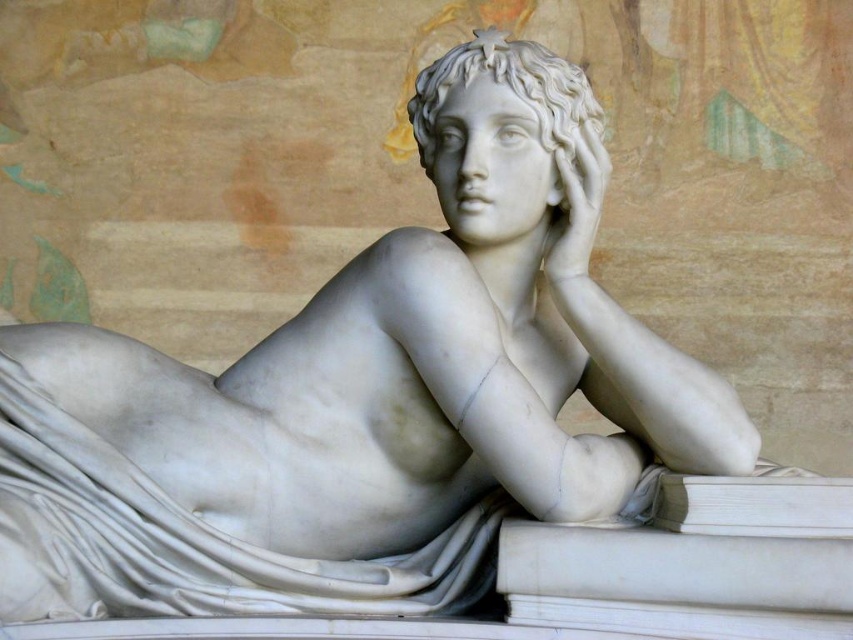
Which is in front, point (527, 67) or point (579, 241)?

Point (579, 241) is in front.

Describe the element at coordinates (509, 90) in the screenshot. The height and width of the screenshot is (640, 853). I see `white marble head at center` at that location.

What are the coordinates of `white marble head at center` in the screenshot? It's located at (509, 90).